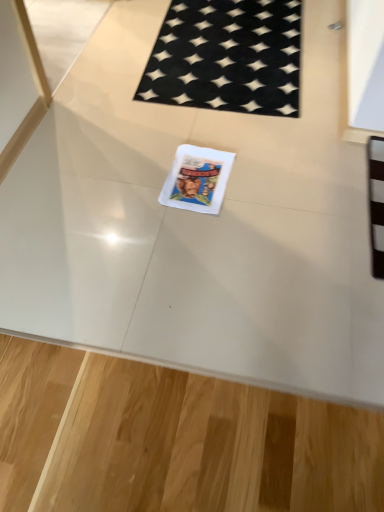
The image size is (384, 512). Identify the location of blank space situated above white paper comic book at center (from a real-world perspective). (197, 177).